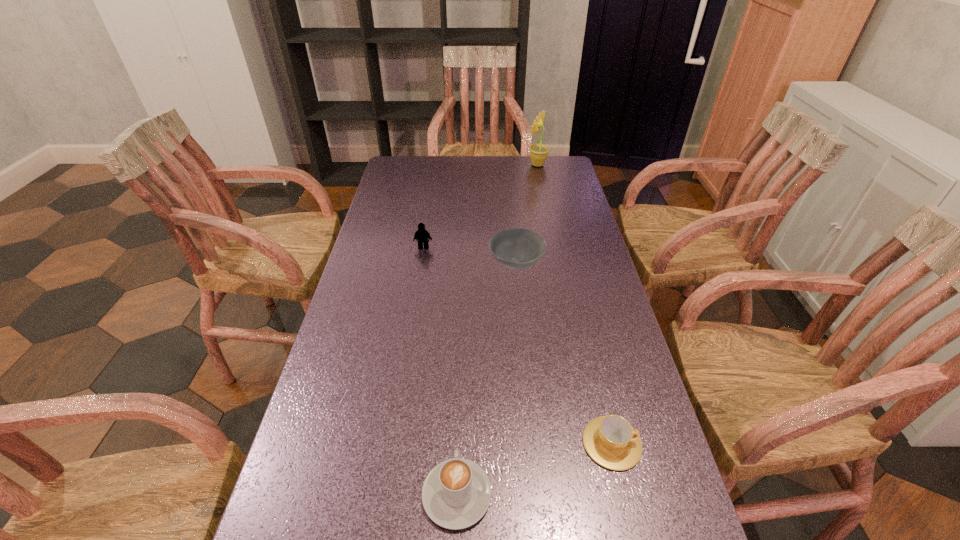
What are the coordinates of `free space located 0.400m to the right of the fourth object from right to left` in the screenshot? It's located at (464, 315).

The image size is (960, 540). I want to click on free spot located to the right of the fourth object from right to left, so click(x=461, y=388).

Locate an element on the screen. Image resolution: width=960 pixels, height=540 pixels. free space located to the right of the fourth object from right to left is located at coordinates (463, 347).

Image resolution: width=960 pixels, height=540 pixels. I want to click on free spot located on the front of the bowl, so click(530, 403).

Find the location of a particular element. Image resolution: width=960 pixels, height=540 pixels. object located in the far edge section of the desktop is located at coordinates (538, 152).

Where is `object present at the left edge`? object present at the left edge is located at coordinates (423, 236).

What are the coordinates of `sunflower positioned at the right edge` in the screenshot? It's located at (538, 152).

Where is `cup situated at the right edge`? This screenshot has width=960, height=540. cup situated at the right edge is located at coordinates coord(611,441).

Where is `object that is at the far right corner`? object that is at the far right corner is located at coordinates (538, 152).

This screenshot has width=960, height=540. Find the location of `vacant space at the far edge of the desktop`. vacant space at the far edge of the desktop is located at coordinates (513, 165).